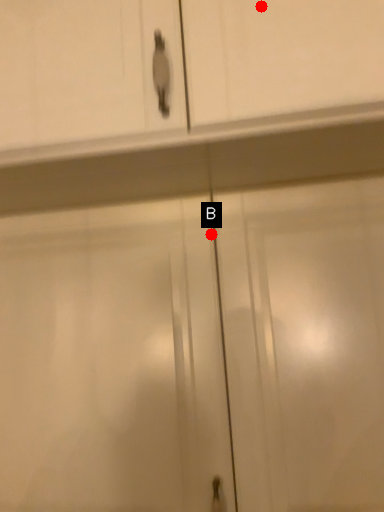
Question: Two points are circled on the image, labeled by A and B beside each circle. Which of the following is the closest to the observer?

Choices:
 (A) A is closer
 (B) B is closer

Answer: (A)